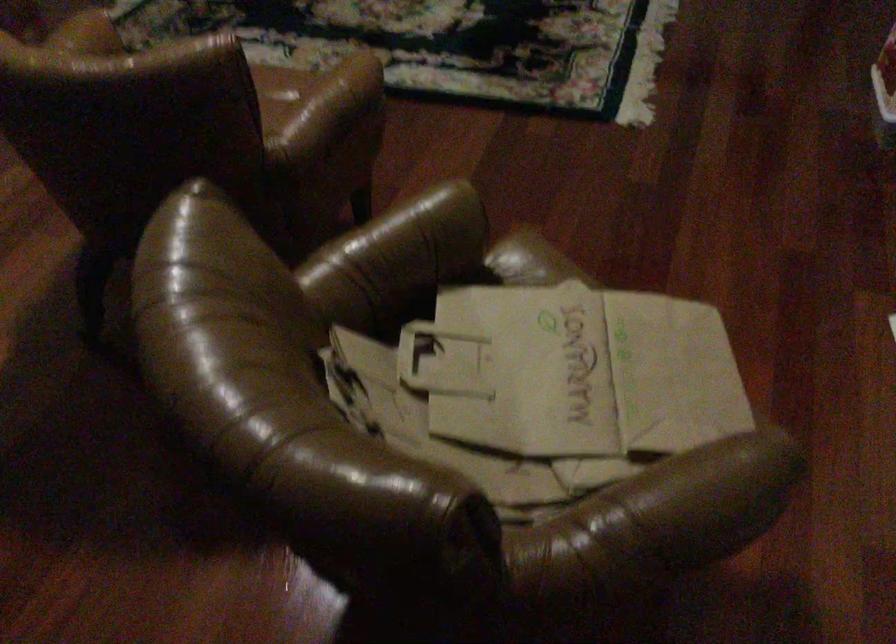
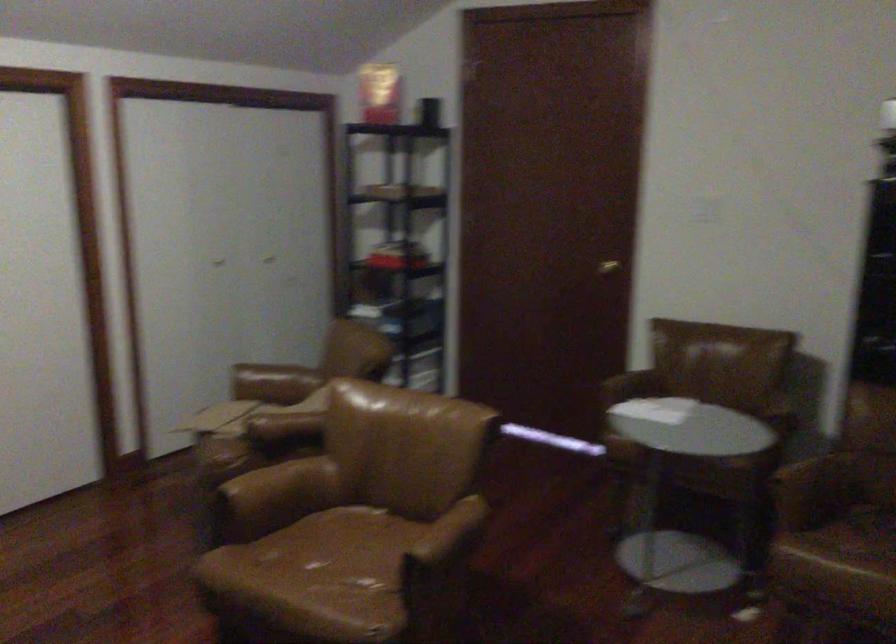
Question: I am providing you with two images of the same scene from different viewpoints. After the viewpoint changes to image2, which objects are now occluded?

Choices:
 (A) brown chair armrest
 (B) brown chair sitting surface
 (C) gold door handle
 (D) none of these

Answer: (D)